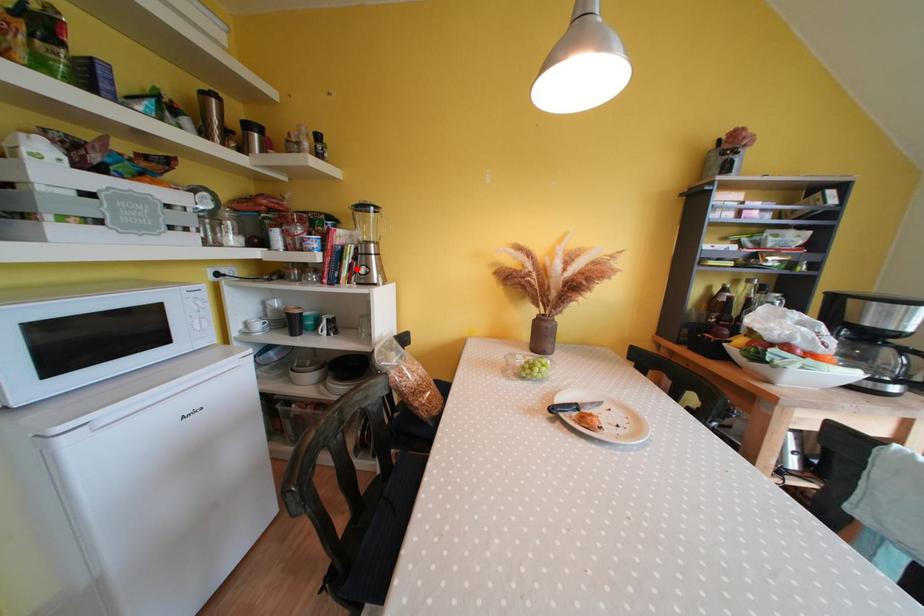
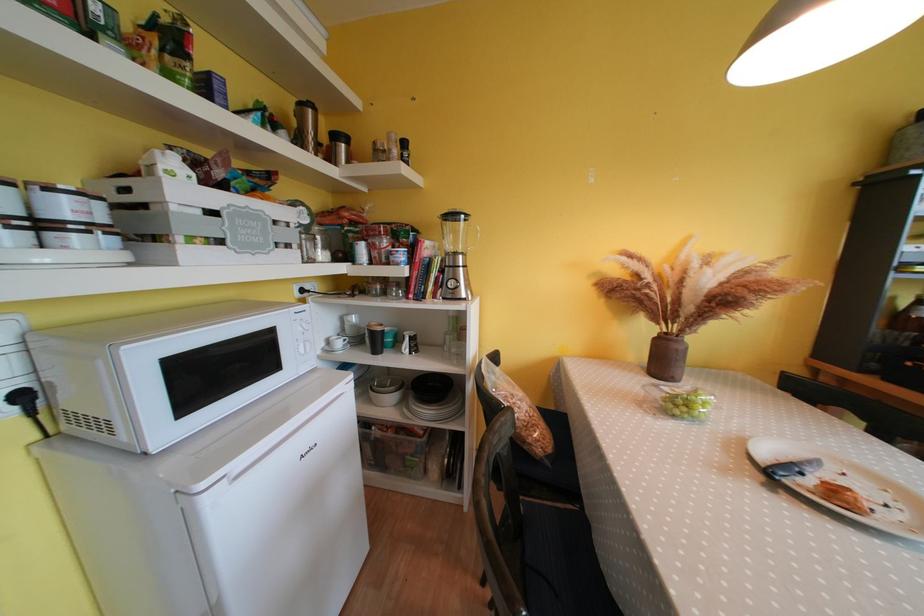
In the second image, find the point that corresponds to the highlighted location in the first image.

(444, 282)